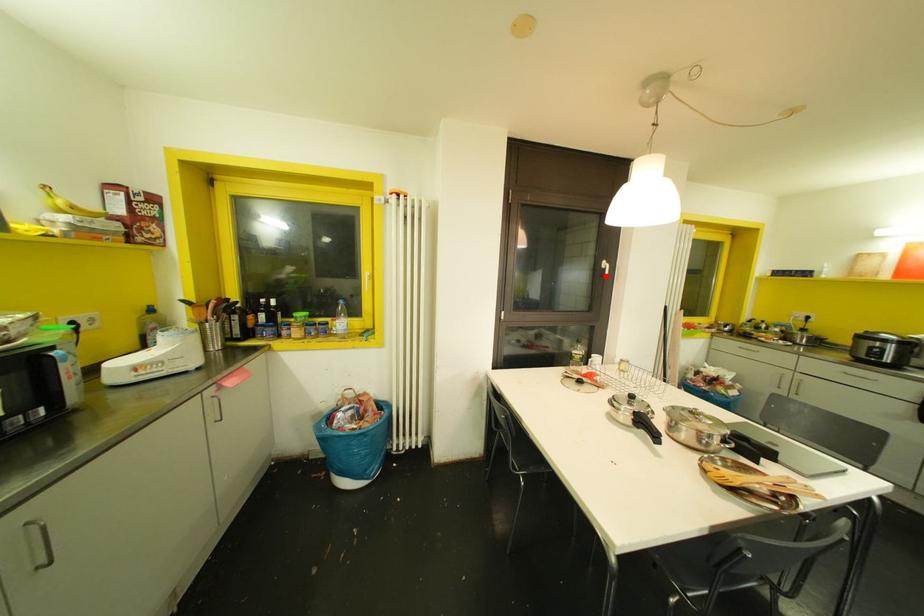
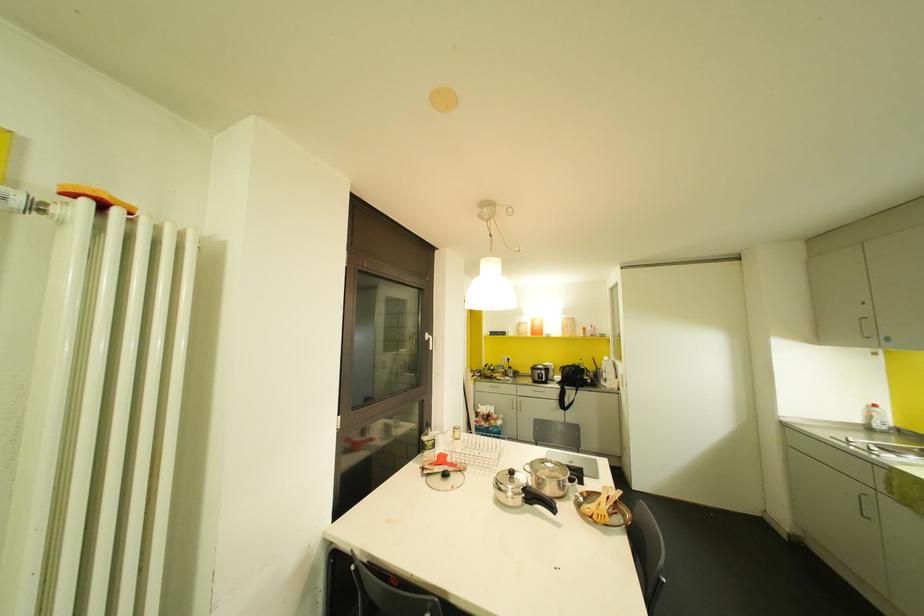
In the second image, find the point that corresponds to the highlighted location in the first image.

(430, 347)